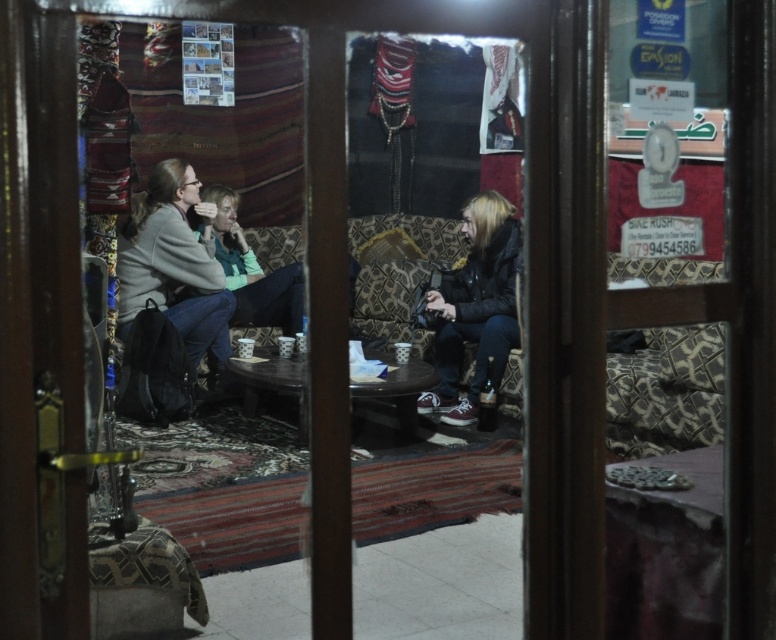
You are a photographer standing outside the partially open wooden door. You want to capture a photo of the light gray sweater at left and the dark gray leather jacket at center. Which one will appear taller in the photo?

The dark gray leather jacket at center will appear taller in the photo because the light gray sweater at left is not as tall as the dark gray leather jacket at center.

You are standing outside the partially open wooden door and want to see the light gray sweater at left and the dark gray leather jacket at center. Which one is closer to the door?

The light gray sweater at left is positioned over the dark gray leather jacket at center, so the light gray sweater at left is closer to the door.

You are standing outside the partially open wooden door and want to greet the person wearing the light gray sweater at left. Which direction should you walk towards relative to the dark gray leather jacket at center?

The light gray sweater at left is to the left of the dark gray leather jacket at center, so you should walk towards the left side relative to the dark gray leather jacket at center to greet the person wearing the light gray sweater at left.